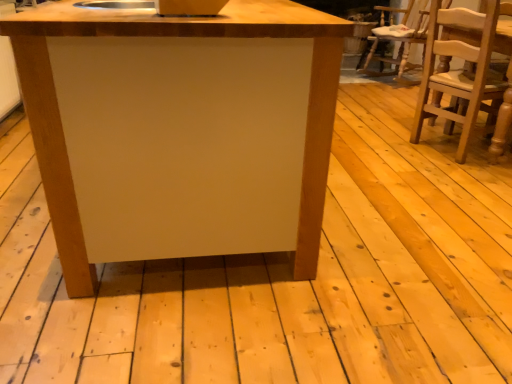
Question: Does matte wood table at center come in front of light brown wooden chair at right?

Choices:
 (A) no
 (B) yes

Answer: (B)

Question: Does matte wood table at center appear on the left side of light brown wooden chair at right?

Choices:
 (A) yes
 (B) no

Answer: (A)

Question: Can you see matte wood table at center touching light brown wooden chair at right?

Choices:
 (A) no
 (B) yes

Answer: (A)

Question: From a real-world perspective, is matte wood table at center on light brown wooden chair at right?

Choices:
 (A) yes
 (B) no

Answer: (B)

Question: From the image's perspective, is matte wood table at center located above light brown wooden chair at right?

Choices:
 (A) yes
 (B) no

Answer: (B)

Question: Can you confirm if matte wood table at center is wider than light brown wooden chair at right?

Choices:
 (A) no
 (B) yes

Answer: (B)

Question: From the image's perspective, would you say light brown wooden chair at right is shown under matte wood table at center?

Choices:
 (A) yes
 (B) no

Answer: (B)

Question: Is light brown wooden chair at right facing towards matte wood table at center?

Choices:
 (A) no
 (B) yes

Answer: (A)

Question: Is light brown wooden chair at right positioned before matte wood table at center?

Choices:
 (A) yes
 (B) no

Answer: (B)

Question: Considering the relative sizes of light brown wooden chair at right and matte wood table at center in the image provided, is light brown wooden chair at right bigger than matte wood table at center?

Choices:
 (A) yes
 (B) no

Answer: (B)

Question: Is light brown wooden chair at right taller than matte wood table at center?

Choices:
 (A) yes
 (B) no

Answer: (A)

Question: Is the position of light brown wooden chair at right more distant than that of matte wood table at center?

Choices:
 (A) yes
 (B) no

Answer: (A)

Question: Is matte wood table at center taller or shorter than light brown wooden chair at right?

Choices:
 (A) tall
 (B) short

Answer: (B)